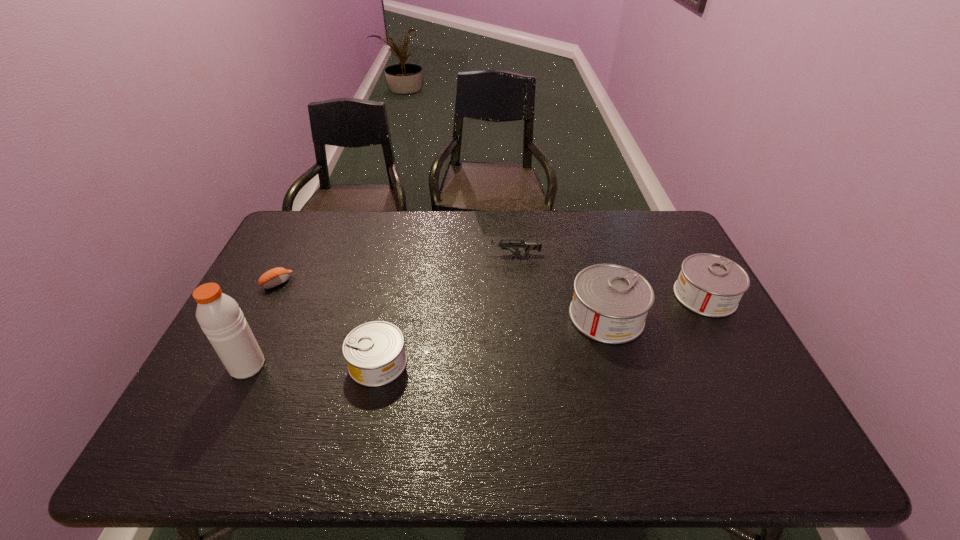
Where is `object that is positioned at the right edge`? Image resolution: width=960 pixels, height=540 pixels. object that is positioned at the right edge is located at coordinates (710, 285).

Where is `free space at the far edge`? This screenshot has width=960, height=540. free space at the far edge is located at coordinates (x=501, y=234).

In the image, there is a desktop. Where is `vacant space at the near edge`? This screenshot has width=960, height=540. vacant space at the near edge is located at coordinates (513, 408).

The width and height of the screenshot is (960, 540). Identify the location of free space at the left edge of the desktop. (266, 308).

Find the location of `free space at the right edge of the desktop`. free space at the right edge of the desktop is located at coordinates (667, 258).

Where is `free space at the far left corner of the desktop`? The height and width of the screenshot is (540, 960). free space at the far left corner of the desktop is located at coordinates (290, 225).

Locate an element on the screen. The image size is (960, 540). free space at the near right corner is located at coordinates (771, 406).

Locate an element on the screen. This screenshot has height=540, width=960. free space between the third object from right to left and the shortest object is located at coordinates (395, 268).

Where is `free space between the gun and the fourth tallest object`? The height and width of the screenshot is (540, 960). free space between the gun and the fourth tallest object is located at coordinates (445, 308).

I want to click on free space that is in between the tallest object and the farthest object, so click(380, 309).